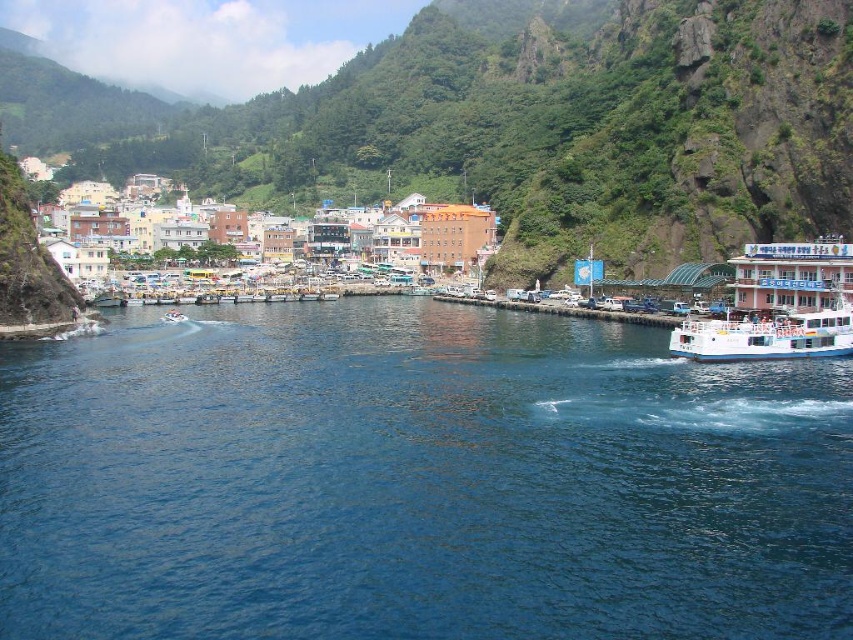
Image resolution: width=853 pixels, height=640 pixels. What do you see at coordinates (416, 481) in the screenshot?
I see `blue liquid water at center` at bounding box center [416, 481].

Where is `blue liquid water at center`? blue liquid water at center is located at coordinates (416, 481).

How far apart are rough rock mountain at upper center and orange matte building at center?

The distance of rough rock mountain at upper center from orange matte building at center is 99.49 meters.

The height and width of the screenshot is (640, 853). I want to click on rough rock mountain at upper center, so click(x=524, y=125).

Find the location of a particular element. Image resolution: width=853 pixels, height=640 pixels. rough rock mountain at upper center is located at coordinates (524, 125).

From the picture: Who is taller, orange matte building at center or white glossy ferry at right?

orange matte building at center

Is orange matte building at center bigger than white glossy ferry at right?

Yes.

Which is behind, point (379, 257) or point (804, 348)?

Positioned behind is point (379, 257).

Locate an element on the screen. orange matte building at center is located at coordinates (422, 234).